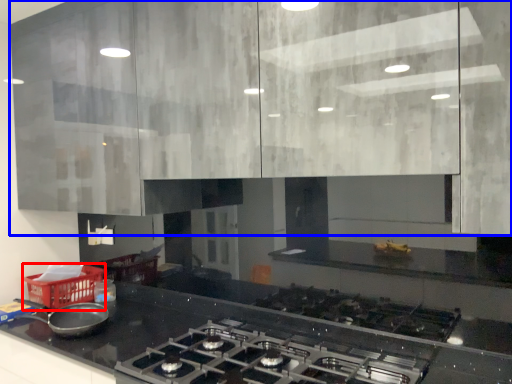
Question: Which object is further to the camera taking this photo, basket (highlighted by a red box) or cabinetry (highlighted by a blue box)?

Choices:
 (A) basket
 (B) cabinetry

Answer: (A)